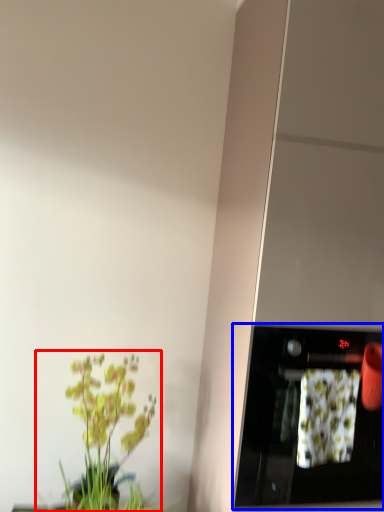
Question: Which of the following is the farthest to the observer, houseplant (highlighted by a red box) or appliance (highlighted by a blue box)?

Choices:
 (A) houseplant
 (B) appliance

Answer: (A)